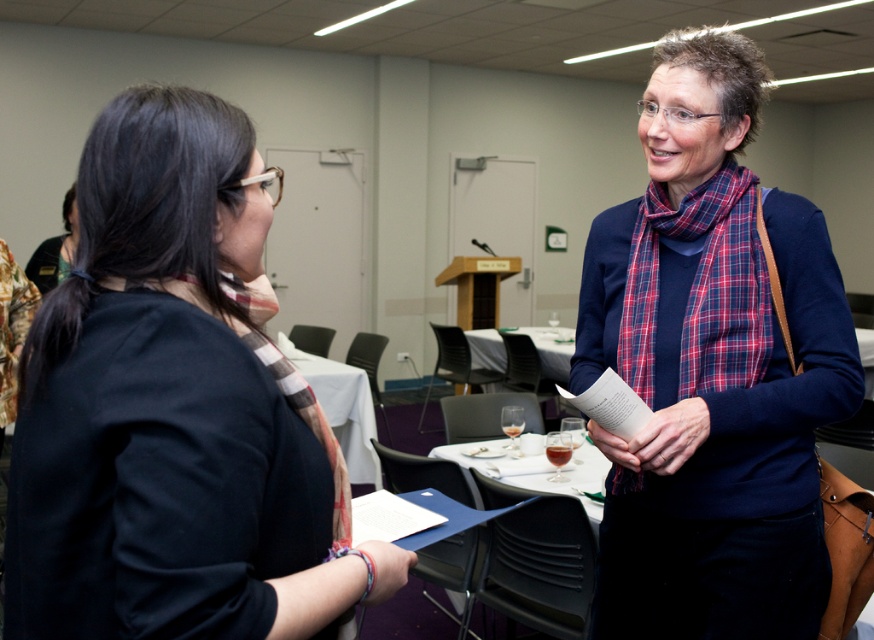
You are standing in the conference room and need to move from point A to point B. Point A is at coordinates point(213, 573) and point B is at coordinates point(359, 472). According to the scene description, which direction should you move to go from point A to point B?

To move from point A to point B, you should move backward since point A is in front of point B according to the description.

You are standing in the conference room and need to place a small object on the white glossy table at center. Is the matte black shirt at left blocking the table?

The matte black shirt at left is in front of the white glossy table at center, so it is blocking the table and you cannot place the object directly on the table without moving the person.